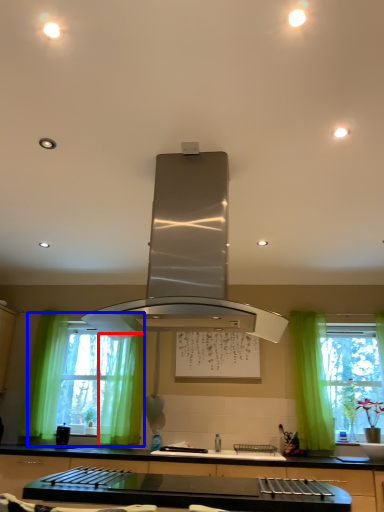
Question: Among these objects, which one is farthest to the camera, curtain (highlighted by a red box) or window (highlighted by a blue box)?

Choices:
 (A) curtain
 (B) window

Answer: (B)